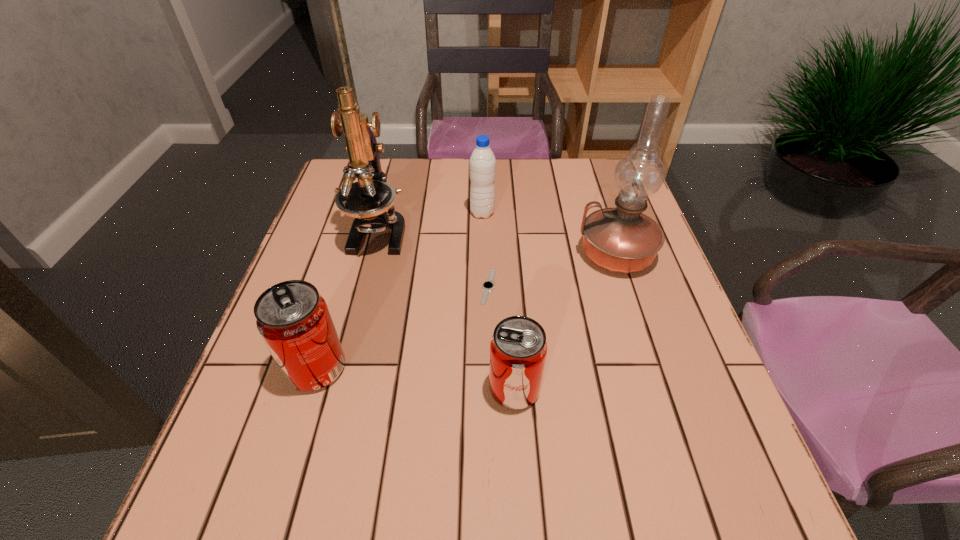
Identify the location of free space at the right edge of the desktop. The image size is (960, 540). (649, 348).

In the image, there is a desktop. In order to click on free region at the far left corner in this screenshot , I will do `click(386, 158)`.

Where is `vacant space at the near left corner of the desktop`? The image size is (960, 540). vacant space at the near left corner of the desktop is located at coordinates tap(239, 440).

Image resolution: width=960 pixels, height=540 pixels. I want to click on free space at the far right corner of the desktop, so click(x=596, y=185).

At what (x,y) coordinates should I click in order to perform the action: click on free space between the shorter pop soda and the taller pop soda. Please return your answer as a coordinate pair (x, y). The image size is (960, 540). Looking at the image, I should click on (416, 379).

Locate an element on the screen. free point between the shortest object and the taller pop soda is located at coordinates (402, 328).

Locate an element on the screen. vacant area that lies between the watch and the water bottle is located at coordinates (486, 250).

Identify the location of vacant area between the water bottle and the right pop soda. The width and height of the screenshot is (960, 540). (498, 301).

You are a GUI agent. You are given a task and a screenshot of the screen. Output one action in this format:
    pyautogui.click(x=<x>, y=<y>)
    Task: Click on the free space between the left pop soda and the microscope
    This screenshot has height=540, width=960.
    Given the screenshot: What is the action you would take?
    pyautogui.click(x=348, y=300)

Image resolution: width=960 pixels, height=540 pixels. What are the coordinates of `empty space between the microscope and the water bottle` in the screenshot? It's located at (430, 222).